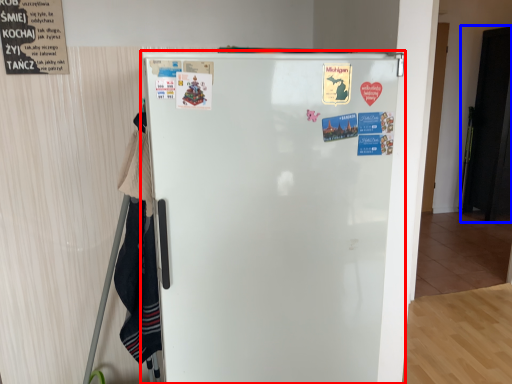
Question: Which of the following is the closest to the observer, refrigerator (highlighted by a red box) or door (highlighted by a blue box)?

Choices:
 (A) refrigerator
 (B) door

Answer: (A)